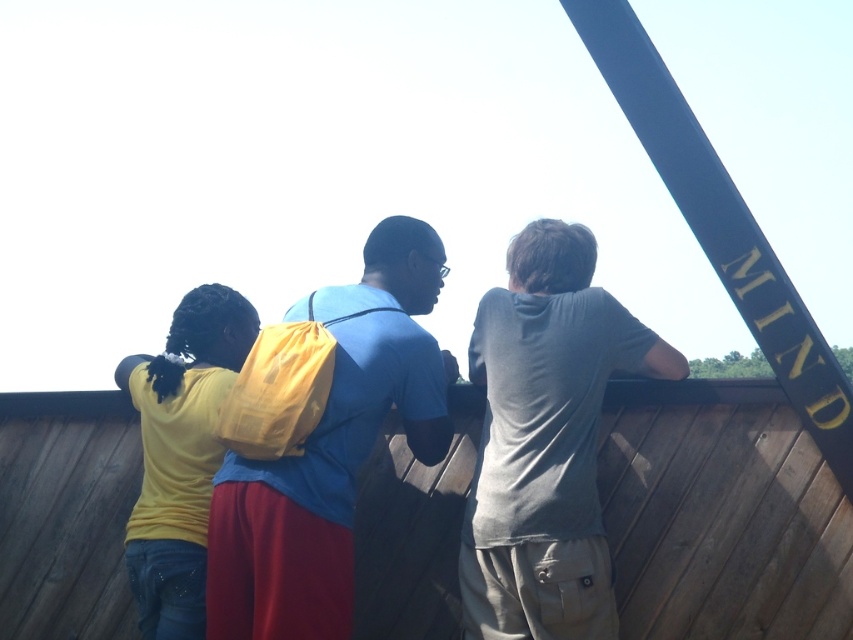
Is gray cotton shirt at upper right below blue polished wood beam at upper right?

Yes, gray cotton shirt at upper right is below blue polished wood beam at upper right.

Which is more to the right, gray cotton shirt at upper right or blue polished wood beam at upper right?

From the viewer's perspective, blue polished wood beam at upper right appears more on the right side.

Does point (584, 419) come behind point (788, 321)?

No.

The image size is (853, 640). Find the location of `gray cotton shirt at upper right`. gray cotton shirt at upper right is located at coordinates (544, 440).

Describe the element at coordinates (544, 440) in the screenshot. This screenshot has height=640, width=853. I see `gray cotton shirt at upper right` at that location.

What do you see at coordinates (544, 440) in the screenshot? This screenshot has width=853, height=640. I see `gray cotton shirt at upper right` at bounding box center [544, 440].

In order to click on gray cotton shirt at upper right in this screenshot , I will do point(544,440).

Is point (241, 577) more distant than point (225, 346)?

No, it is in front of (225, 346).

Between point (370, 316) and point (242, 342), which one is positioned in front?

Point (370, 316) is in front.

Locate an element on the screen. blue matte shirt at center is located at coordinates tap(331, 451).